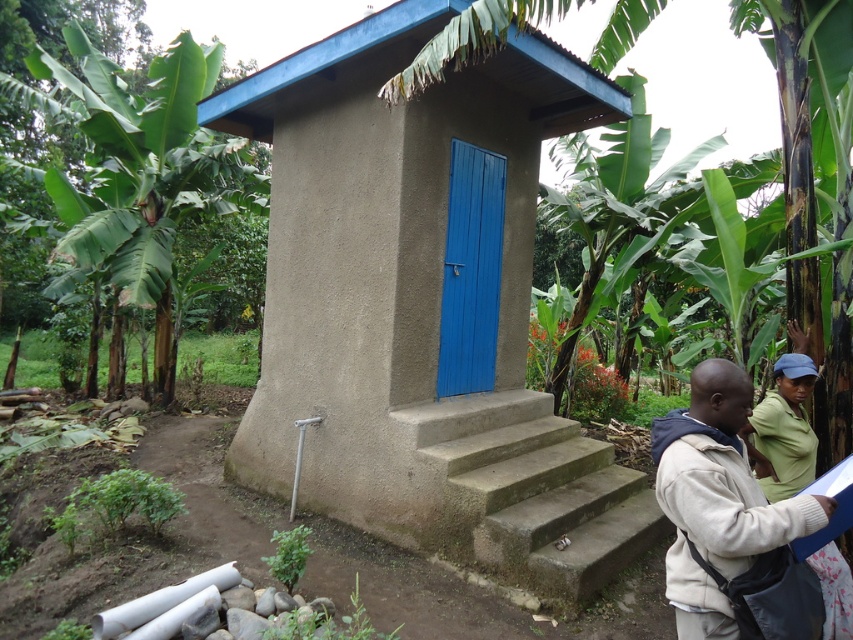
You are standing at a point in a tropical garden and want to reach the latrine with a blue roof and door. The latrine is located at point (184, 145). Can you estimate whether you are closer than 10 meters to the latrine?

The distance between you and the latrine at point (184, 145) is 7.86 meters, which is less than 10 meters. Therefore, you are within 10 meters of the latrine.

You are standing in front of the latrine structure and want to approach the concrete stairs at center. Which direction should you walk relative to the green leafy banana tree at left?

You should walk to the right side of the green leafy banana tree at left because the concrete stairs at center is positioned on the right side of it.